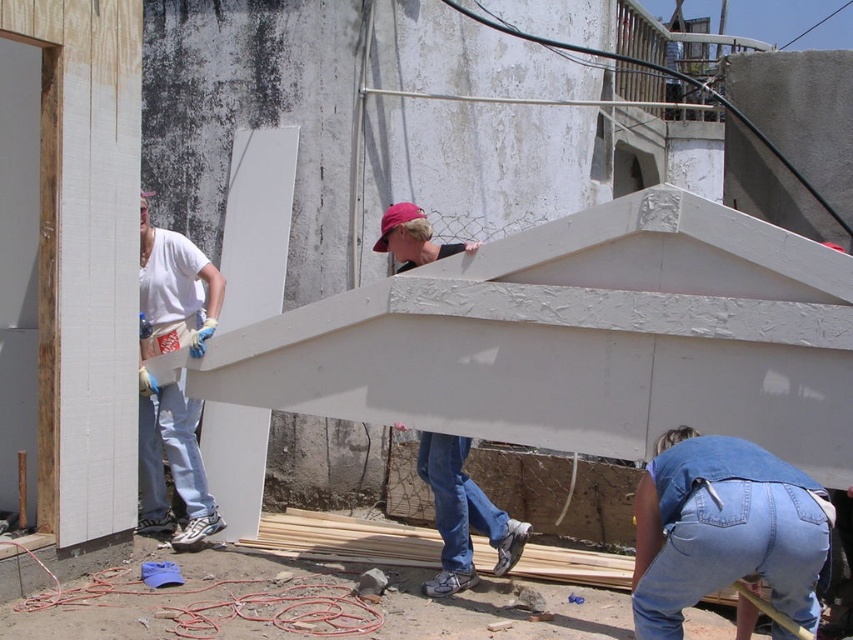
Question: Is denim jeans at lower right to the right of matte white board at center from the viewer's perspective?

Choices:
 (A) no
 (B) yes

Answer: (B)

Question: Which point is farther to the camera?

Choices:
 (A) (637, 552)
 (B) (202, 524)
 (C) (397, 259)

Answer: (C)

Question: From the image, what is the correct spatial relationship of white matte t-shirt at left in relation to matte white board at center?

Choices:
 (A) below
 (B) above

Answer: (B)

Question: Which of the following is the closest to the observer?

Choices:
 (A) matte white board at center
 (B) denim jeans at lower right
 (C) white matte t-shirt at left

Answer: (B)

Question: Which object is closer to the camera taking this photo?

Choices:
 (A) denim jeans at lower right
 (B) matte white board at center
 (C) white matte t-shirt at left

Answer: (A)

Question: Can you confirm if white matte t-shirt at left is smaller than matte white board at center?

Choices:
 (A) no
 (B) yes

Answer: (A)